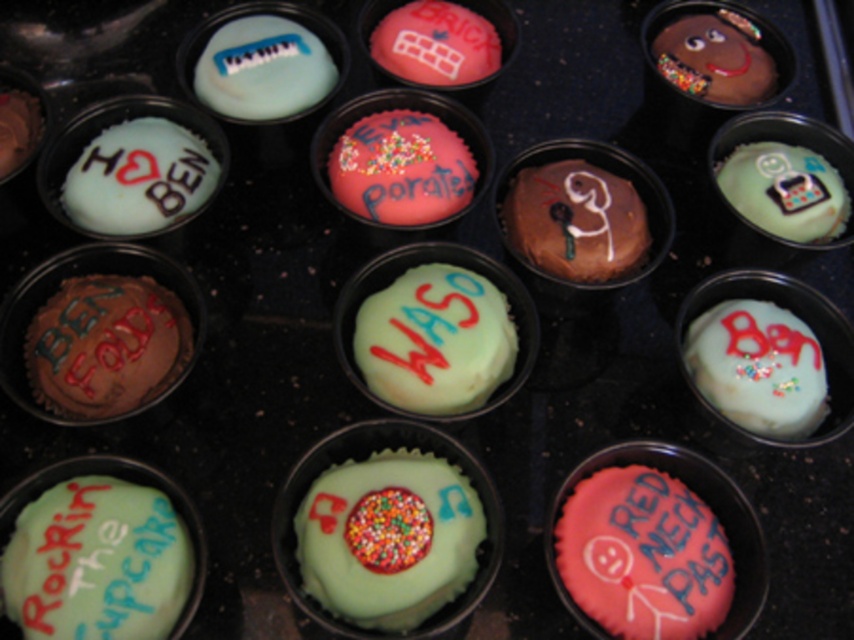
Question: From the image, what is the correct spatial relationship of pink frosted cupcake at center right in relation to smooth pink cupcake at center?

Choices:
 (A) right
 (B) left

Answer: (A)

Question: Which of the following is the farthest from the observer?

Choices:
 (A) smooth pink cupcake at center
 (B) matte white frosting at upper left
 (C) pink frosted cupcake at center right
 (D) brown chocolate cupcake at left

Answer: (A)

Question: Does matte white frosting at upper left have a larger size compared to pink frosted cupcake at center right?

Choices:
 (A) no
 (B) yes

Answer: (A)

Question: Which of these objects is positioned farthest from the matte white frosting at upper left?

Choices:
 (A) brown chocolate cupcake at left
 (B) pink frosted cupcake at center right

Answer: (B)

Question: Which point is closer to the camera?

Choices:
 (A) (249, 88)
 (B) (408, 51)
 (C) (747, 614)
 (D) (44, 378)

Answer: (C)

Question: Does matte white frosting at upper left have a greater width compared to pink frosted cupcake at center right?

Choices:
 (A) yes
 (B) no

Answer: (B)